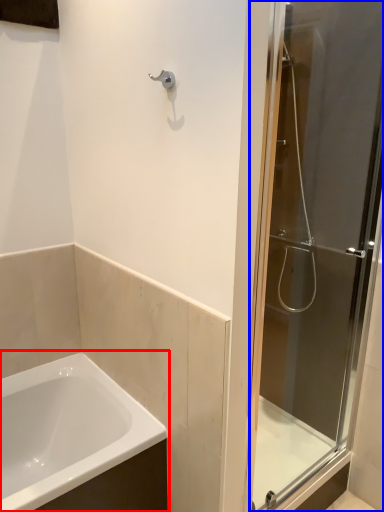
Question: Which object appears farthest to the camera in this image, bathtub (highlighted by a red box) or door (highlighted by a blue box)?

Choices:
 (A) bathtub
 (B) door

Answer: (A)